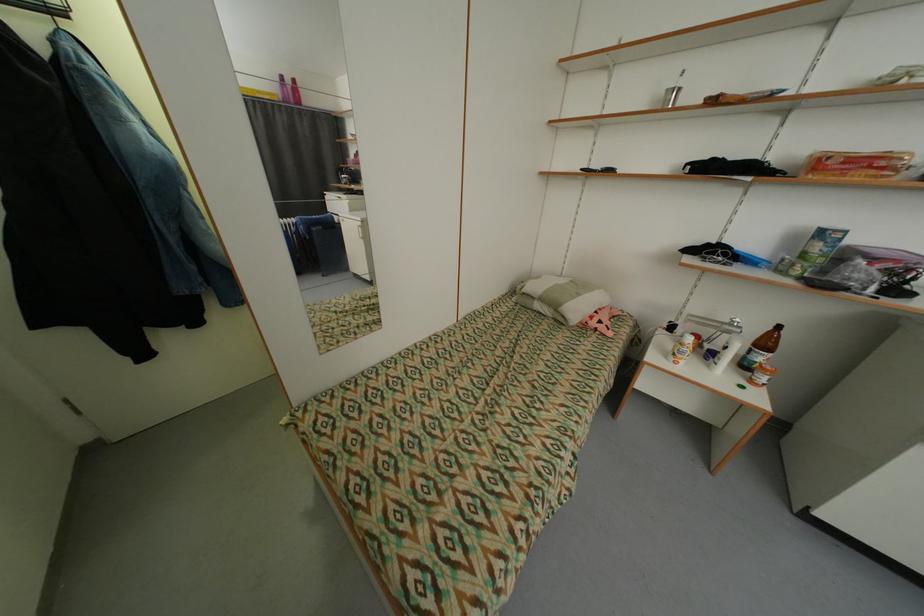
The image size is (924, 616). In order to click on brown glass bottle in this screenshot , I will do `click(760, 349)`.